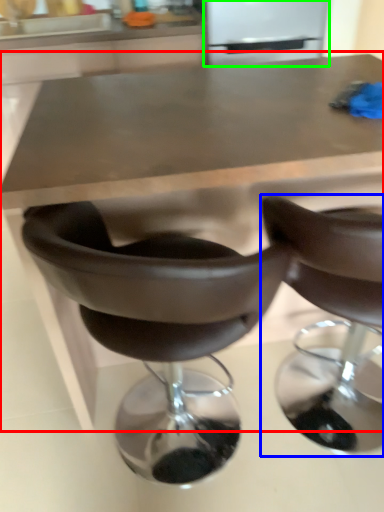
Question: Which object is positioned closest to table (highlighted by a red box)? Select from chair (highlighted by a blue box) and appliance (highlighted by a green box).

Choices:
 (A) chair
 (B) appliance

Answer: (A)